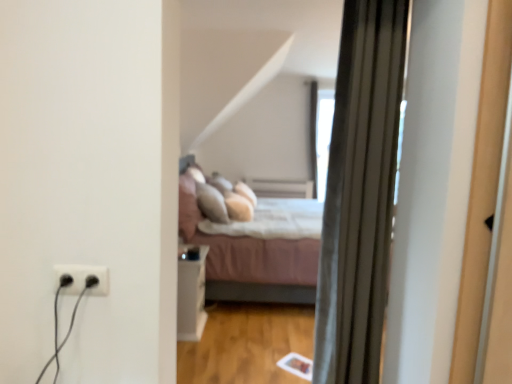
I want to click on black plastic outlet at lower left, so click(82, 279).

The height and width of the screenshot is (384, 512). Describe the element at coordinates (360, 192) in the screenshot. I see `silky gray curtain at right` at that location.

The width and height of the screenshot is (512, 384). What do you see at coordinates (249, 259) in the screenshot?
I see `pink fabric bed at center` at bounding box center [249, 259].

In order to click on white glossy side table at center in this screenshot , I will do `click(191, 297)`.

Identify the location of black plastic outlet at lower left. (82, 279).

You are a GUI agent. You are given a task and a screenshot of the screen. Output one action in this format:
    pyautogui.click(x=<x>, y=<y>)
    Task: Click on the bed behind the silky gray curtain at right
    The height and width of the screenshot is (384, 512).
    Given the screenshot: What is the action you would take?
    pyautogui.click(x=249, y=259)

Is silky gray curtain at right facing towards pink fabric bed at center?

Yes, silky gray curtain at right is aimed at pink fabric bed at center.

Who is bigger, silky gray curtain at right or pink fabric bed at center?

pink fabric bed at center is bigger.

Is white glossy side table at center spatially inside black plastic outlet at lower left, or outside of it?

white glossy side table at center cannot be found inside black plastic outlet at lower left.

Who is taller, white glossy side table at center or black plastic outlet at lower left?

white glossy side table at center is taller.

Is white glossy side table at center turned away from black plastic outlet at lower left?

No, white glossy side table at center is not facing away from black plastic outlet at lower left.

Can you confirm if white glossy side table at center is bigger than black plastic outlet at lower left?

Correct, white glossy side table at center is larger in size than black plastic outlet at lower left.

Would you say pink fabric bed at center is a long distance from black plastic outlet at lower left?

That's right, there is a large distance between pink fabric bed at center and black plastic outlet at lower left.

Between pink fabric bed at center and black plastic outlet at lower left, which one has larger size?

pink fabric bed at center.

From the image's perspective, between pink fabric bed at center and black plastic outlet at lower left, who is located below?

pink fabric bed at center, from the image's perspective.

Who is more distant, black plastic outlet at lower left or pink fabric bed at center?

Positioned behind is pink fabric bed at center.

Does black plastic outlet at lower left have a lesser width compared to pink fabric bed at center?

Yes.

From their relative heights in the image, would you say black plastic outlet at lower left is taller or shorter than pink fabric bed at center?

Clearly, black plastic outlet at lower left is shorter compared to pink fabric bed at center.

In the scene shown: Is black plastic outlet at lower left directly adjacent to pink fabric bed at center?

No, black plastic outlet at lower left is not in contact with pink fabric bed at center.

From the image's perspective, is pink fabric bed at center under silky gray curtain at right?

Indeed, from the image's perspective, pink fabric bed at center is shown beneath silky gray curtain at right.

Can you tell me how much pink fabric bed at center and silky gray curtain at right differ in facing direction?

90.6 degrees separate the facing orientations of pink fabric bed at center and silky gray curtain at right.

Considering the relative positions of pink fabric bed at center and silky gray curtain at right in the image provided, is pink fabric bed at center to the right of silky gray curtain at right from the viewer's perspective?

No.

Is silky gray curtain at right at the left side of black plastic outlet at lower left?

No, silky gray curtain at right is not to the left of black plastic outlet at lower left.

Is silky gray curtain at right facing away from black plastic outlet at lower left?

No, silky gray curtain at right is not facing the opposite direction of black plastic outlet at lower left.

From a real-world perspective, who is located higher, silky gray curtain at right or black plastic outlet at lower left?

In real-world perspective, silky gray curtain at right is above.

Is silky gray curtain at right touching black plastic outlet at lower left?

They are not placed beside each other.

Is the position of white glossy side table at center more distant than that of silky gray curtain at right?

Yes, it is behind silky gray curtain at right.

From a real-world perspective, is white glossy side table at center above or below silky gray curtain at right?

In terms of real-world spatial position, white glossy side table at center is below silky gray curtain at right.

You are a GUI agent. You are given a task and a screenshot of the screen. Output one action in this format:
    pyautogui.click(x=<x>, y=<y>)
    Task: Click on the table behind the silky gray curtain at right
    The image size is (512, 384).
    Given the screenshot: What is the action you would take?
    pyautogui.click(x=191, y=297)

Which of these two, white glossy side table at center or silky gray curtain at right, is wider?

With larger width is silky gray curtain at right.

The image size is (512, 384). In the image, there is a pink fabric bed at center. In order to click on curtain above it (from the image's perspective) in this screenshot , I will do `click(360, 192)`.

Where is `table below the black plastic outlet at lower left (from the image's perspective)`? The image size is (512, 384). table below the black plastic outlet at lower left (from the image's perspective) is located at coordinates (191, 297).

Consider the image. When comparing their distances from pink fabric bed at center, does black plastic outlet at lower left or silky gray curtain at right seem closer?

The object closer to pink fabric bed at center is silky gray curtain at right.

Estimate the real-world distances between objects in this image. Which object is closer to black plastic outlet at lower left, white glossy side table at center or pink fabric bed at center?

white glossy side table at center lies closer to black plastic outlet at lower left than the other object.

Consider the image. Looking at the image, which one is located closer to silky gray curtain at right, pink fabric bed at center or white glossy side table at center?

Based on the image, white glossy side table at center appears to be nearer to silky gray curtain at right.

Consider the image. When comparing their distances from black plastic outlet at lower left, does pink fabric bed at center or white glossy side table at center seem further?

pink fabric bed at center.

From the picture: From the image, which object appears to be nearer to pink fabric bed at center, silky gray curtain at right or black plastic outlet at lower left?

silky gray curtain at right is closer to pink fabric bed at center.

From the image, which object appears to be nearer to black plastic outlet at lower left, silky gray curtain at right or pink fabric bed at center?

silky gray curtain at right is closer to black plastic outlet at lower left.

From the image, which object appears to be nearer to white glossy side table at center, silky gray curtain at right or black plastic outlet at lower left?

silky gray curtain at right.

Based on their spatial positions, is silky gray curtain at right or pink fabric bed at center closer to white glossy side table at center?

pink fabric bed at center lies closer to white glossy side table at center than the other object.

You are a GUI agent. You are given a task and a screenshot of the screen. Output one action in this format:
    pyautogui.click(x=<x>, y=<y>)
    Task: Click on the table between silky gray curtain at right and pink fabric bed at center in the front-back direction
    The height and width of the screenshot is (384, 512).
    Given the screenshot: What is the action you would take?
    pyautogui.click(x=191, y=297)

This screenshot has height=384, width=512. Find the location of `table between black plastic outlet at lower left and pink fabric bed at center in the front-back direction`. table between black plastic outlet at lower left and pink fabric bed at center in the front-back direction is located at coordinates (191, 297).

Identify the location of curtain located between black plastic outlet at lower left and pink fabric bed at center in the depth direction. The image size is (512, 384). (360, 192).

Locate an element on the screen. curtain located between black plastic outlet at lower left and white glossy side table at center in the depth direction is located at coordinates (360, 192).